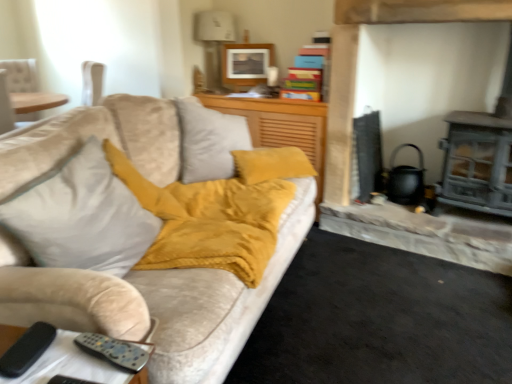
Question: Is matte gray fireplace at right taller or shorter than matte wooden picture frame at upper center?

Choices:
 (A) tall
 (B) short

Answer: (A)

Question: Considering the positions of point (356, 6) and point (251, 52), is point (356, 6) closer or farther from the camera than point (251, 52)?

Choices:
 (A) farther
 (B) closer

Answer: (B)

Question: Which object is the closest to the velvet yellow throw pillow at center?

Choices:
 (A) suede-like mustard yellow cushion at center
 (B) matte gray fireplace at right
 (C) metallic silver remote control at lower left
 (D) matte wooden picture frame at upper center

Answer: (C)

Question: Which object is the farthest from the velvet yellow throw pillow at center?

Choices:
 (A) matte gray fireplace at right
 (B) metallic silver remote control at lower left
 (C) matte wooden picture frame at upper center
 (D) suede-like mustard yellow cushion at center

Answer: (C)